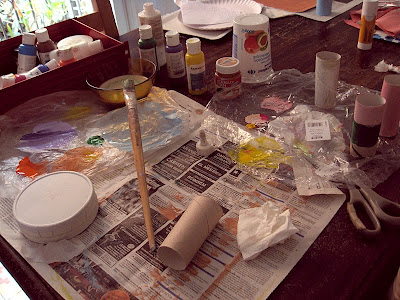
The image size is (400, 300). In order to click on napkins in this screenshot , I will do `click(259, 232)`.